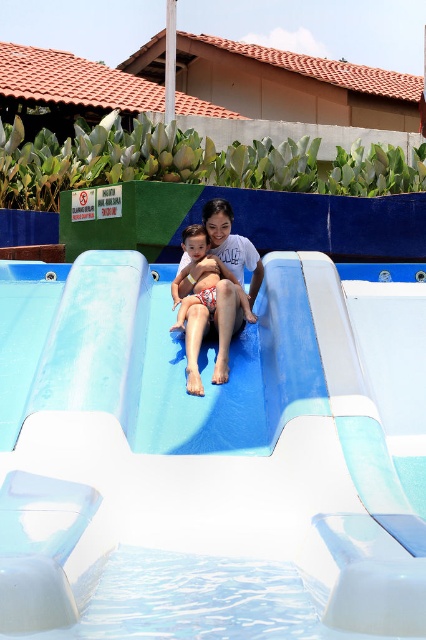
Question: Which point is farther to the camera?

Choices:
 (A) white smooth slide at center
 (B) white textured shorts at center

Answer: (B)

Question: From the image, what is the correct spatial relationship of white smooth slide at center in relation to matte skin child at center?

Choices:
 (A) left
 (B) right

Answer: (A)

Question: Which is nearer to the white smooth slide at center?

Choices:
 (A) matte skin child at center
 (B) white textured shorts at center

Answer: (B)

Question: Is the position of white smooth slide at center more distant than that of matte skin child at center?

Choices:
 (A) no
 (B) yes

Answer: (A)

Question: Among these objects, which one is farthest from the camera?

Choices:
 (A) matte skin child at center
 (B) white smooth slide at center
 (C) white textured shorts at center

Answer: (A)

Question: Is white smooth slide at center to the left of white textured shorts at center from the viewer's perspective?

Choices:
 (A) yes
 (B) no

Answer: (A)